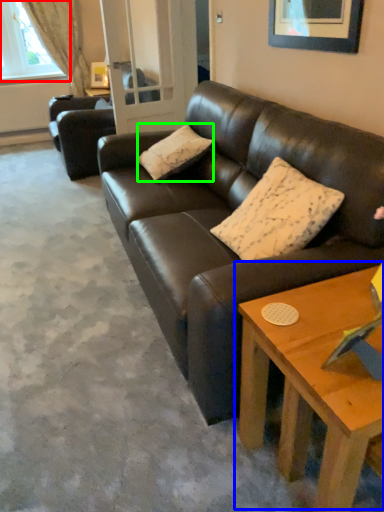
Question: Which object is positioned farthest from window (highlighted by a red box)? Select from coffee table (highlighted by a blue box) and pillow (highlighted by a green box).

Choices:
 (A) coffee table
 (B) pillow

Answer: (A)